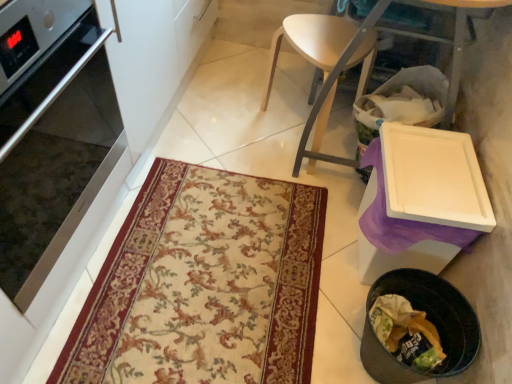
Find the location of `free area below light wood chair at center (from a real-world perspective)`. free area below light wood chair at center (from a real-world perspective) is located at coordinates (279, 123).